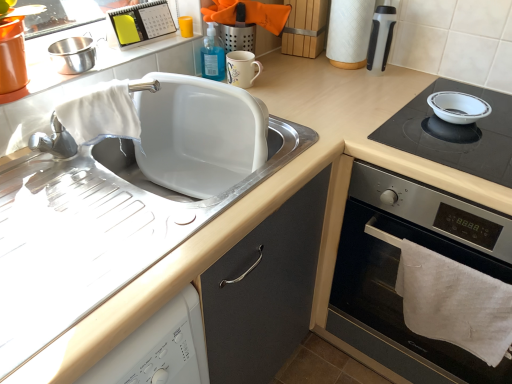
The width and height of the screenshot is (512, 384). In order to click on vacant area in front of matte black thermos at upper right, positioned as the 1th appliance in right-to-left order in this screenshot , I will do `click(375, 94)`.